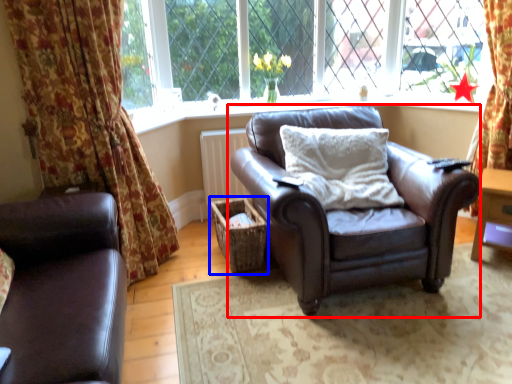
Question: Which object is further to the camera taking this photo, chair (highlighted by a red box) or crate (highlighted by a blue box)?

Choices:
 (A) chair
 (B) crate

Answer: (B)